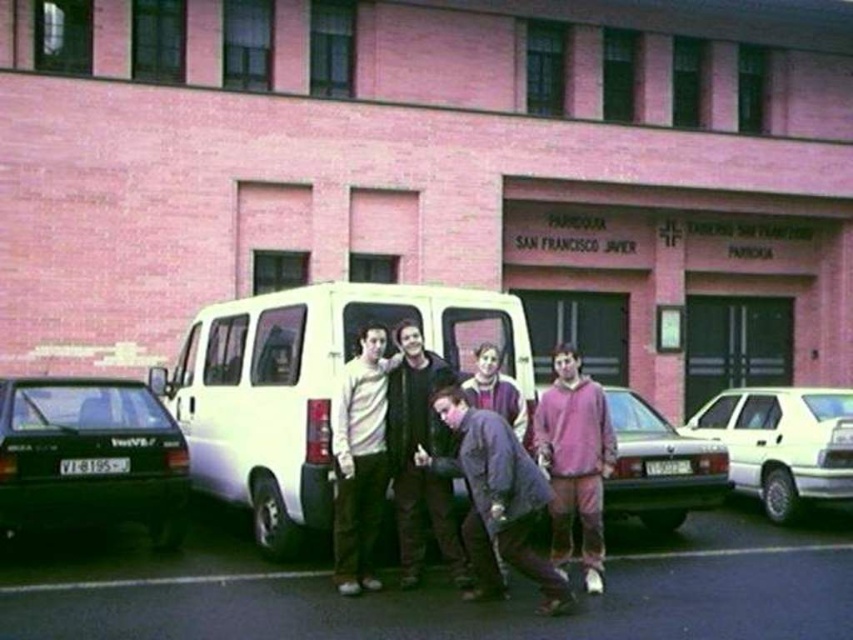
Between point (500, 540) and point (492, 348), which one is positioned behind?

The point (492, 348) is behind.

Find the location of a particular element. This screenshot has width=853, height=640. dark gray fabric jacket at center is located at coordinates (498, 500).

Can you confirm if black asphalt at lower center is thinner than pink matte car at center?

Yes.

Between point (305, 608) and point (614, 513), which one is positioned in front?

Point (305, 608) is more forward.

Locate an element on the screen. The width and height of the screenshot is (853, 640). black asphalt at lower center is located at coordinates (437, 588).

This screenshot has width=853, height=640. What are the coordinates of `black asphalt at lower center` in the screenshot? It's located at (437, 588).

Does dark gray fabric jacket at center appear over dark brown leather jacket at center?

No.

This screenshot has height=640, width=853. What do you see at coordinates (498, 500) in the screenshot? I see `dark gray fabric jacket at center` at bounding box center [498, 500].

Find the location of a particular element. dark gray fabric jacket at center is located at coordinates (498, 500).